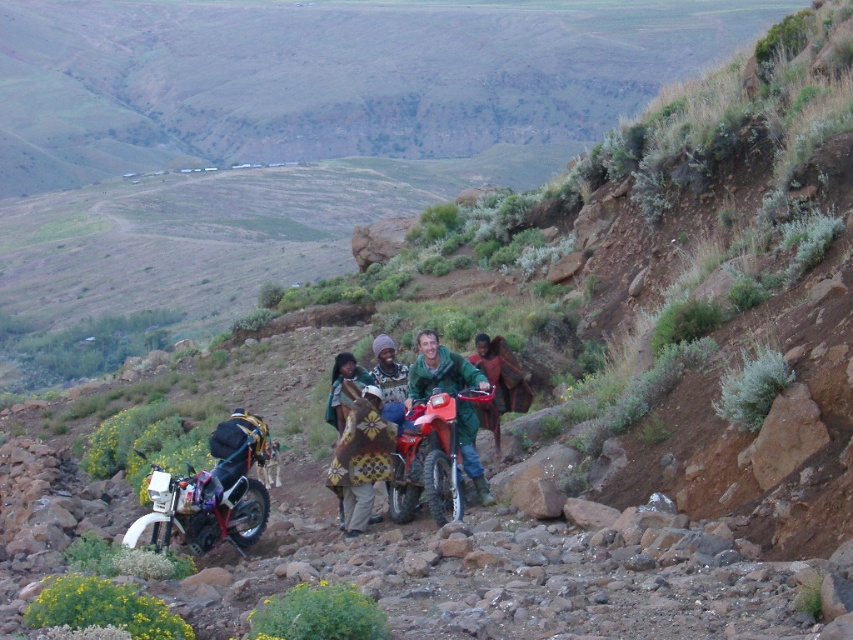
You are a hiker who wants to take a photo of the knitted wool sweater at center while avoiding the matte black motorcycle at lower left. Where should you position yourself to ensure the motorcycle is out of the frame?

Position yourself above the knitted wool sweater at center so that the matte black motorcycle at lower left, which is below it, is out of view.

You are an outdoor enthusiast preparing for a hike in the mountains. You have a knitted woolen shawl at center and a knitted wool sweater at center in your backpack. According to the scene, which item is currently covering the other?

The knitted woolen shawl at center is positioned under the knitted wool sweater at center, meaning the sweater is covering the shawl.